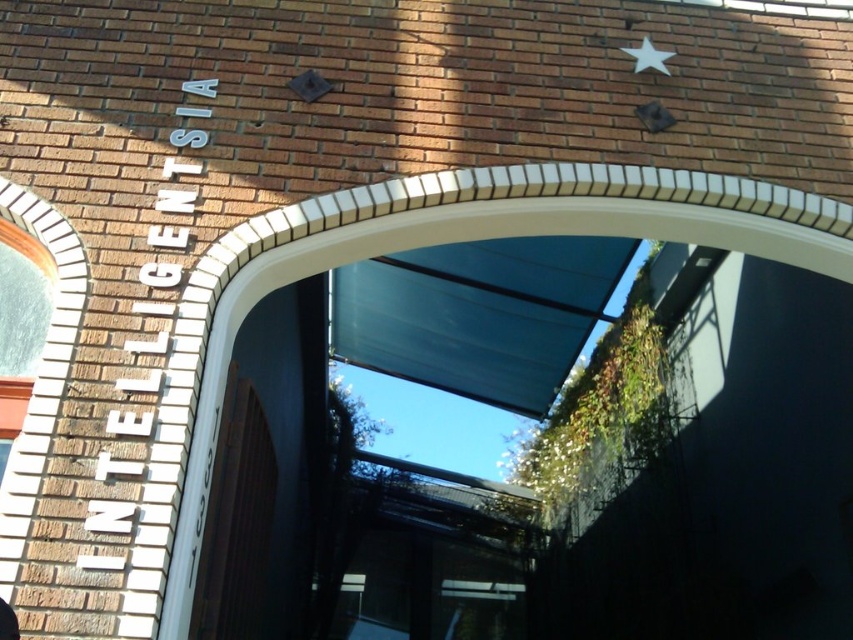
Between white brick archway at center and white matte star at upper right, which one is positioned higher?

white matte star at upper right

Is white brick archway at center to the left of white matte star at upper right from the viewer's perspective?

Correct, you'll find white brick archway at center to the left of white matte star at upper right.

Describe the element at coordinates (466, 241) in the screenshot. This screenshot has width=853, height=640. I see `white brick archway at center` at that location.

Locate an element on the screen. The image size is (853, 640). white brick archway at center is located at coordinates (466, 241).